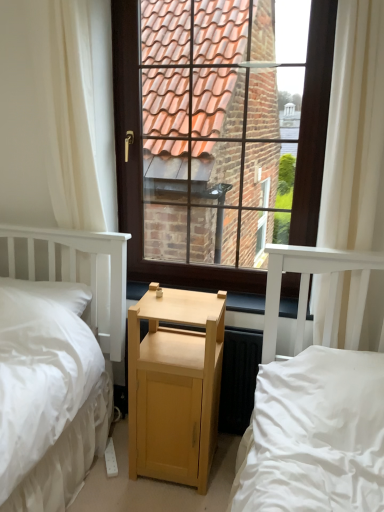
What are the coordinates of `light wood bed at center` in the screenshot? It's located at (308, 288).

The image size is (384, 512). What do you see at coordinates (354, 128) in the screenshot?
I see `white sheer curtain at upper right, the 2th curtain from the left` at bounding box center [354, 128].

In order to face white sheer curtain at left, the 1th curtain viewed from the left, should I rotate leftwards or rightwards?

You should look left and rotate roughly 16.645 degrees.

Find the location of a particular element. wooden at center is located at coordinates (245, 303).

What is the approximate width of wooden at center?

The width of wooden at center is 9.79 inches.

Describe the element at coordinates (175, 386) in the screenshot. I see `light wood nightstand at center` at that location.

Image resolution: width=384 pixels, height=512 pixels. Find the location of `white soft pillow at left`. white soft pillow at left is located at coordinates (54, 292).

Measure the distance between point (55,282) and camera.

Point (55,282) is 7.14 feet away from camera.

At what (x,y) coordinates should I click in order to perform the action: click on light wood bed at center. Please return your answer as a coordinate pair (x, y). The height and width of the screenshot is (512, 384). Looking at the image, I should click on (308, 288).

Consider the image. Between brown wooden window at center and white soft pillow at left, which one has larger width?

white soft pillow at left is wider.

Between brown wooden window at center and white soft pillow at left, which one appears on the right side from the viewer's perspective?

brown wooden window at center.

Is point (217, 109) closer or farther from the camera than point (84, 286)?

Clearly, point (217, 109) is more distant from the camera than point (84, 286).

Between light wood bed at center and light wood nightstand at center, which one has larger width?

With larger width is light wood bed at center.

Is light wood bed at center smaller than light wood nightstand at center?

Actually, light wood bed at center might be larger than light wood nightstand at center.

Which object is more forward, light wood bed at center or light wood nightstand at center?

light wood bed at center is more forward.

Does point (288, 271) come farther from viewer compared to point (150, 441)?

No, (288, 271) is closer to viewer.

Considering the relative positions of light wood bed at center and wooden at center in the image provided, is light wood bed at center to the left of wooden at center from the viewer's perspective?

No, light wood bed at center is not to the left of wooden at center.

Which is correct: light wood bed at center is inside wooden at center, or outside of it?

light wood bed at center lies outside wooden at center.

Which is behind, light wood bed at center or wooden at center?

Positioned behind is wooden at center.

Between light wood bed at center and wooden at center, which one has more height?

With more height is light wood bed at center.

Considering the sizes of objects light wood bed at center and white sheer curtain at upper right, arranged as the first curtain when viewed from the right, in the image provided, who is bigger, light wood bed at center or white sheer curtain at upper right, arranged as the first curtain when viewed from the right,?

Bigger between the two is light wood bed at center.

Based on the photo, how different are the orientations of light wood bed at center and white sheer curtain at upper right, the 2th curtain from the left, in degrees?

The angle between the facing direction of light wood bed at center and the facing direction of white sheer curtain at upper right, the 2th curtain from the left, is 2.23 degrees.

Which object is closer to the camera taking this photo, light wood bed at center or white sheer curtain at upper right, the 2th curtain from the left?

Positioned in front is light wood bed at center.

You are a GUI agent. You are given a task and a screenshot of the screen. Output one action in this format:
    pyautogui.click(x=<x>, y=<y>)
    Task: Click on the curtain on the right of the light wood bed at center
    The width and height of the screenshot is (384, 512).
    Given the screenshot: What is the action you would take?
    pyautogui.click(x=354, y=128)

Find the location of a particular element. nightstand on the left of brown wooden window at center is located at coordinates point(175,386).

Does brown wooden window at center appear on the left side of light wood nightstand at center?

No.

Is brown wooden window at center beside light wood nightstand at center?

brown wooden window at center and light wood nightstand at center are clearly separated.

Between point (160, 11) and point (176, 359), which one is positioned in front?

The point (176, 359) is in front.

Can light wood nightstand at center be found inside wooden at center?

No, light wood nightstand at center is not inside wooden at center.

Which is more to the left, wooden at center or light wood nightstand at center?

From the viewer's perspective, light wood nightstand at center appears more on the left side.

From a real-world perspective, is wooden at center above or below light wood nightstand at center?

wooden at center is above light wood nightstand at center.

Does point (240, 310) appear closer or farther from the camera than point (136, 387)?

Point (240, 310) appears to be farther away from the viewer than point (136, 387).

This screenshot has width=384, height=512. I want to click on window sill beneath the white soft pillow at left (from a real-world perspective), so click(x=245, y=303).

Considering the sizes of objects white soft pillow at left and wooden at center in the image provided, who is wider, white soft pillow at left or wooden at center?

With larger width is white soft pillow at left.

From a real-world perspective, is white soft pillow at left above or below wooden at center?

white soft pillow at left is situated higher than wooden at center in the real world.

From the image's perspective, is white soft pillow at left on wooden at center?

Yes, from the image's perspective, white soft pillow at left is over wooden at center.

The height and width of the screenshot is (512, 384). Identify the location of window in front of the white soft pillow at left. (210, 135).

At what (x,y) coordinates should I click in order to perform the action: click on bed below the light wood nightstand at center (from the image's perspective). Please return your answer as a coordinate pair (x, y). The width and height of the screenshot is (384, 512). Looking at the image, I should click on (308, 288).

Considering their positions, is wooden at center positioned closer to brown wooden window at center than white sheer curtain at left, positioned as the second curtain in right-to-left order?

The object closer to brown wooden window at center is white sheer curtain at left, positioned as the second curtain in right-to-left order.

Looking at the image, which one is located closer to light wood bed at center, light wood nightstand at center or wooden at center?

The object closer to light wood bed at center is wooden at center.

Estimate the real-world distances between objects in this image. Which object is further from white sheer curtain at upper right, the 2th curtain from the left, brown wooden window at center or white soft pillow at left?

brown wooden window at center is further to white sheer curtain at upper right, the 2th curtain from the left.

Based on their spatial positions, is white soft pillow at left or light wood nightstand at center further from wooden at center?

The object further to wooden at center is white soft pillow at left.

Which object lies further to the anchor point white sheer curtain at upper right, arranged as the first curtain when viewed from the right, wooden at center or white soft pillow at left?

Based on the image, white soft pillow at left appears to be further to white sheer curtain at upper right, arranged as the first curtain when viewed from the right.

Consider the image. Estimate the real-world distances between objects in this image. Which object is closer to brown wooden window at center, light wood nightstand at center or wooden at center?

light wood nightstand at center is closer to brown wooden window at center.

Based on their spatial positions, is white sheer curtain at upper right, the 2th curtain from the left, or light wood bed at center closer to brown wooden window at center?

white sheer curtain at upper right, the 2th curtain from the left, is closer to brown wooden window at center.

When comparing their distances from white sheer curtain at left, the 1th curtain viewed from the left, does wooden at center or white soft pillow at left seem further?

Based on the image, wooden at center appears to be further to white sheer curtain at left, the 1th curtain viewed from the left.

Where is `nightstand between light wood bed at center and white sheer curtain at left, positioned as the second curtain in right-to-left order, from front to back`? The width and height of the screenshot is (384, 512). nightstand between light wood bed at center and white sheer curtain at left, positioned as the second curtain in right-to-left order, from front to back is located at coordinates (175, 386).

Where is `curtain between light wood bed at center and white sheer curtain at left, the 1th curtain viewed from the left, from front to back`? This screenshot has width=384, height=512. curtain between light wood bed at center and white sheer curtain at left, the 1th curtain viewed from the left, from front to back is located at coordinates (354, 128).

I want to click on window sill between white sheer curtain at left, the 1th curtain viewed from the left, and light wood nightstand at center in the up-down direction, so click(245, 303).

You are a GUI agent. You are given a task and a screenshot of the screen. Output one action in this format:
    pyautogui.click(x=<x>, y=<y>)
    Task: Click on the pillow that lies between white sheer curtain at left, the 1th curtain viewed from the left, and light wood nightstand at center from top to bottom
    Image resolution: width=384 pixels, height=512 pixels.
    Given the screenshot: What is the action you would take?
    (54, 292)